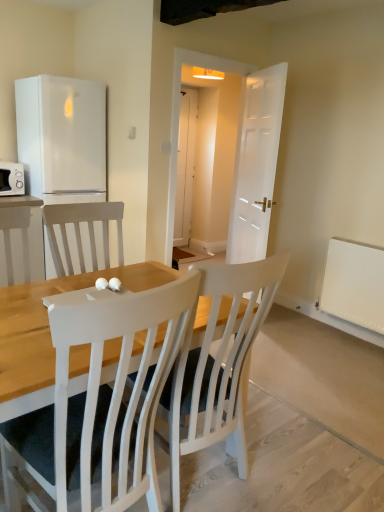
Question: Should I look upward or downward to see white wood chair at center?

Choices:
 (A) down
 (B) up

Answer: (A)

Question: Is the position of white matte refrigerator at left less distant than that of white matte radiator at lower right?

Choices:
 (A) yes
 (B) no

Answer: (B)

Question: From the image's perspective, is white matte refrigerator at left located above white matte radiator at lower right?

Choices:
 (A) yes
 (B) no

Answer: (A)

Question: Is white matte refrigerator at left thinner than white matte radiator at lower right?

Choices:
 (A) yes
 (B) no

Answer: (B)

Question: Is white matte refrigerator at left at the left side of white matte radiator at lower right?

Choices:
 (A) yes
 (B) no

Answer: (A)

Question: Is white matte refrigerator at left placed right next to white matte radiator at lower right?

Choices:
 (A) yes
 (B) no

Answer: (B)

Question: Does white matte refrigerator at left appear on the right side of white matte radiator at lower right?

Choices:
 (A) no
 (B) yes

Answer: (A)

Question: Is white matte refrigerator at left at the back of white matte radiator at lower right?

Choices:
 (A) no
 (B) yes

Answer: (A)

Question: From a real-world perspective, is white matte radiator at lower right located beneath white matte refrigerator at left?

Choices:
 (A) no
 (B) yes

Answer: (B)

Question: Can you confirm if white matte radiator at lower right is positioned to the left of white matte refrigerator at left?

Choices:
 (A) yes
 (B) no

Answer: (B)

Question: Is white matte radiator at lower right positioned in front of white matte refrigerator at left?

Choices:
 (A) no
 (B) yes

Answer: (B)

Question: Can we say white matte radiator at lower right lies outside white matte refrigerator at left?

Choices:
 (A) yes
 (B) no

Answer: (A)

Question: Considering the relative sizes of white matte radiator at lower right and white matte refrigerator at left in the image provided, is white matte radiator at lower right thinner than white matte refrigerator at left?

Choices:
 (A) yes
 (B) no

Answer: (A)

Question: Can you confirm if white matte microwave at left is shorter than white wood chair at center?

Choices:
 (A) no
 (B) yes

Answer: (A)